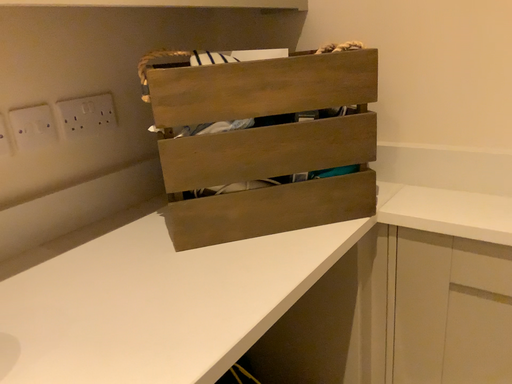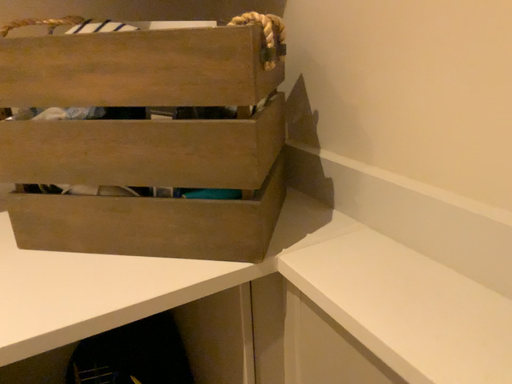
Question: Which way did the camera rotate in the video?

Choices:
 (A) rotated right
 (B) rotated left

Answer: (B)